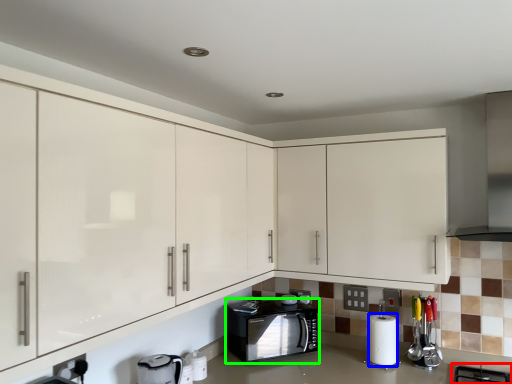
Question: Considering the real-world distances, which object is farthest from gas stove (highlighted by a red box)? paper towel (highlighted by a blue box) or home appliance (highlighted by a green box)?

Choices:
 (A) paper towel
 (B) home appliance

Answer: (B)